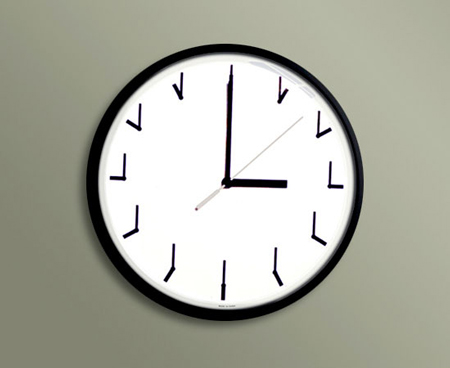
The height and width of the screenshot is (368, 450). In order to click on empty space bottom of clock in this screenshot , I will do `click(226, 347)`.